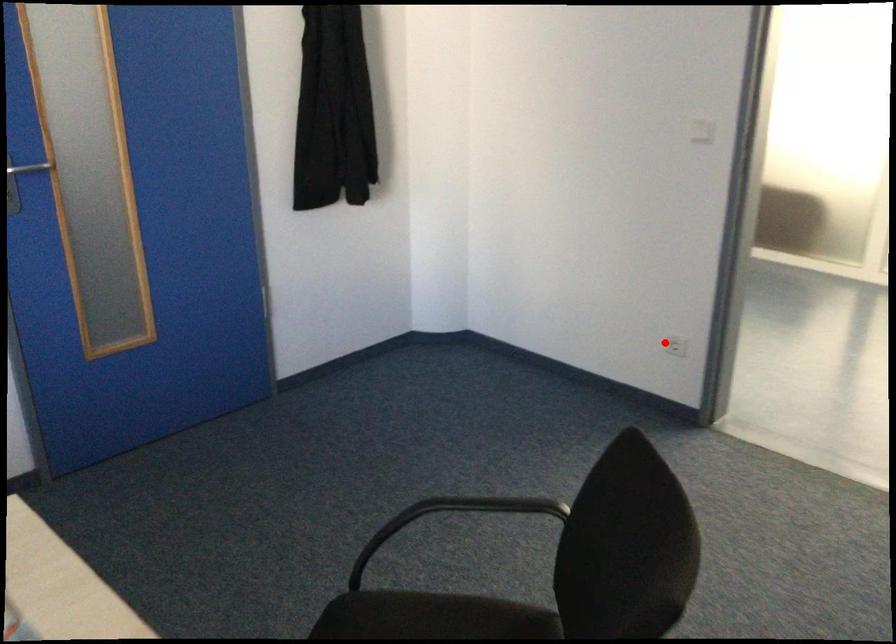
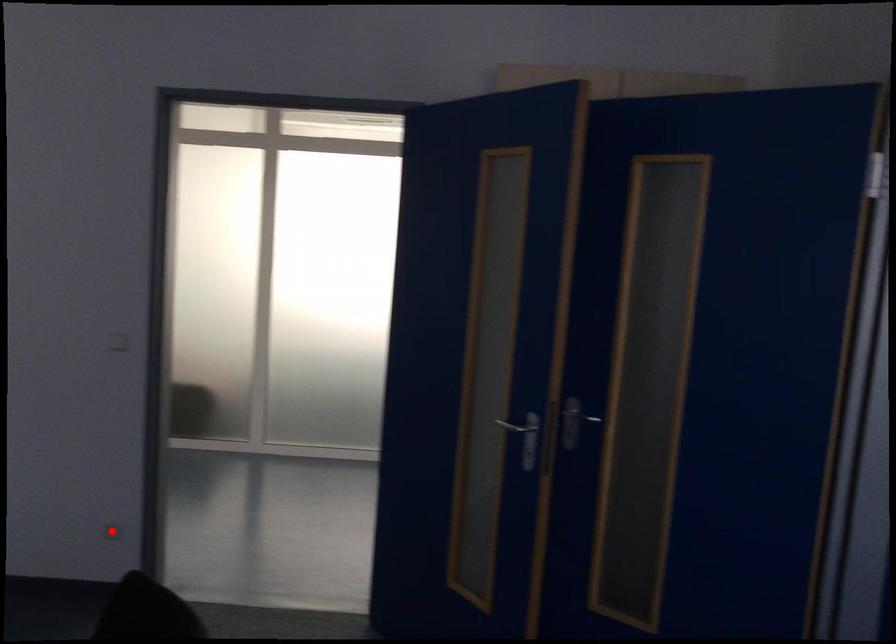
I am providing you with two images of the same scene from different viewpoints. A red point is marked on the first image and another point is marked on the second image. Does the point marked in image1 correspond to the same location as the one in image2?

Yes